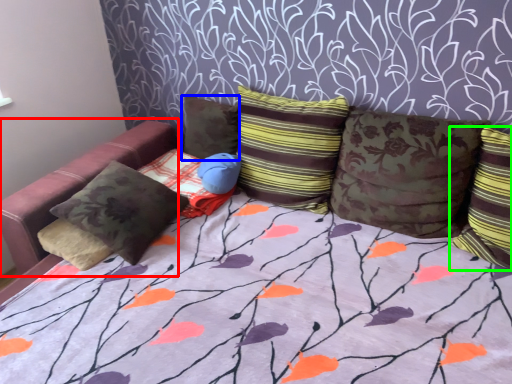
Question: Which object is positioned farthest from bean bag chair (highlighted by a red box)? Select from pillow (highlighted by a blue box) and pillow (highlighted by a green box).

Choices:
 (A) pillow
 (B) pillow

Answer: (B)